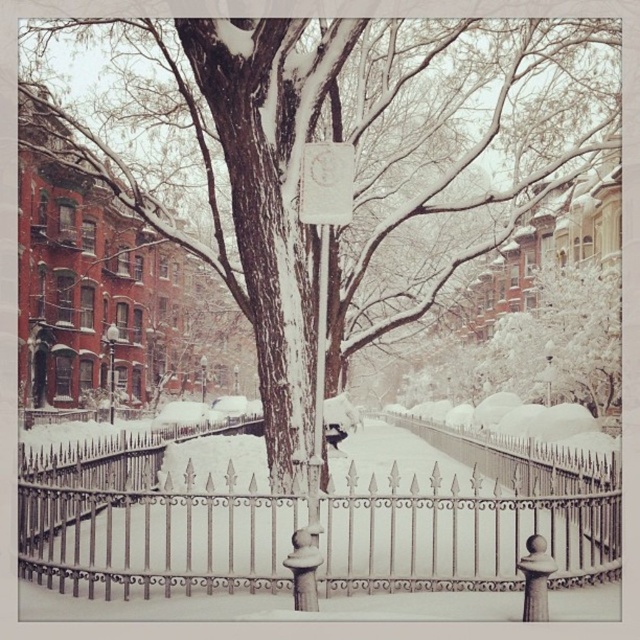
Question: Which object is the farthest from the white wrought iron fence at center?

Choices:
 (A) white paper at center
 (B) snow-covered bark at center

Answer: (B)

Question: Where is white paper at center located in relation to white matte sign at center in the image?

Choices:
 (A) right
 (B) left

Answer: (A)

Question: Can you confirm if snow-covered bark at center is positioned below white paper at center?

Choices:
 (A) no
 (B) yes

Answer: (A)

Question: Which point appears farthest from the camera in this image?

Choices:
 (A) (352, 182)
 (B) (99, 524)

Answer: (B)

Question: Which object appears farthest from the camera in this image?

Choices:
 (A) white wrought iron fence at center
 (B) white paper at center

Answer: (B)

Question: Is snow-covered bark at center smaller than white wrought iron fence at center?

Choices:
 (A) no
 (B) yes

Answer: (A)